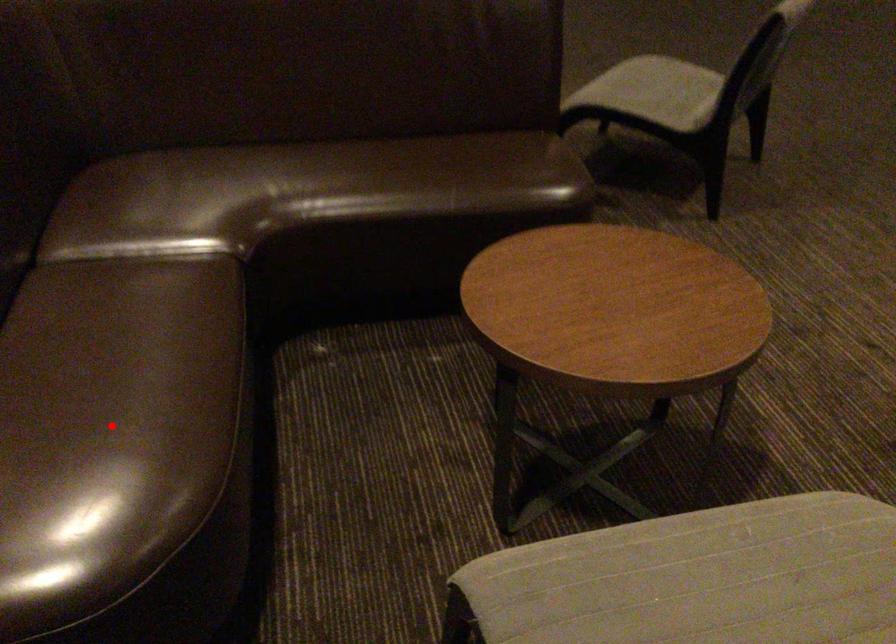
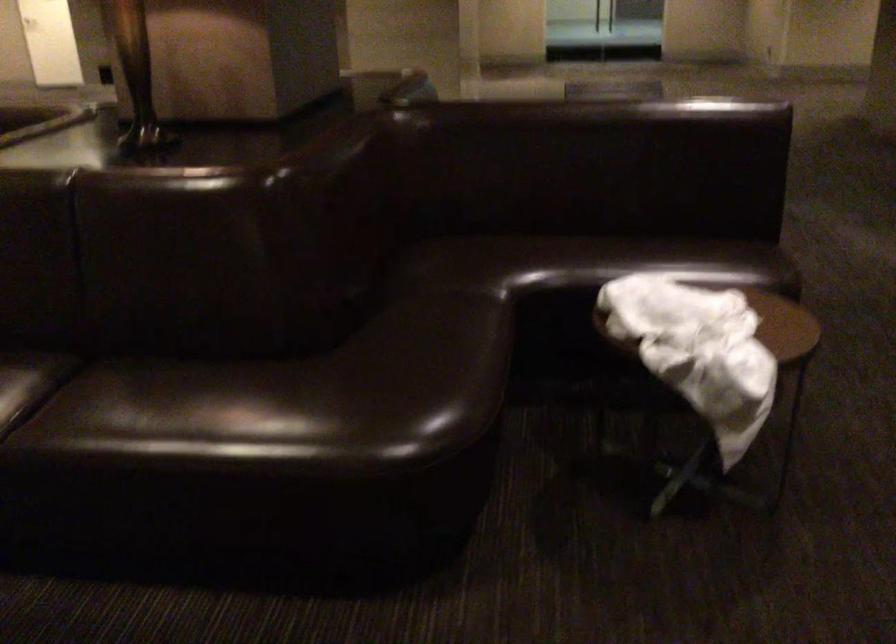
Question: I am providing you with two images of the same scene from different viewpoints. A red point is marked on the first image. At the location where the point appears in image 1, is it still visible in image 2?

Choices:
 (A) Yes
 (B) No

Answer: (B)